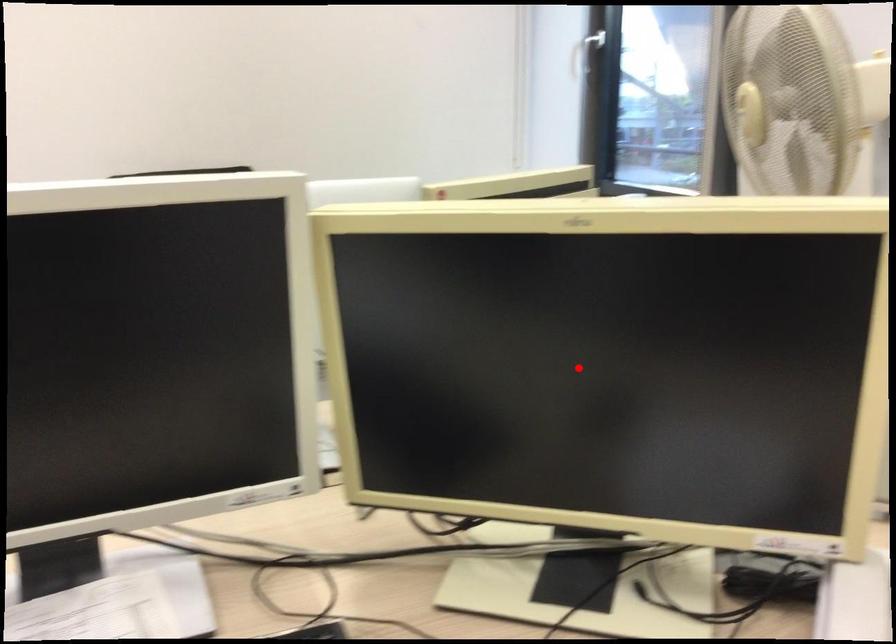
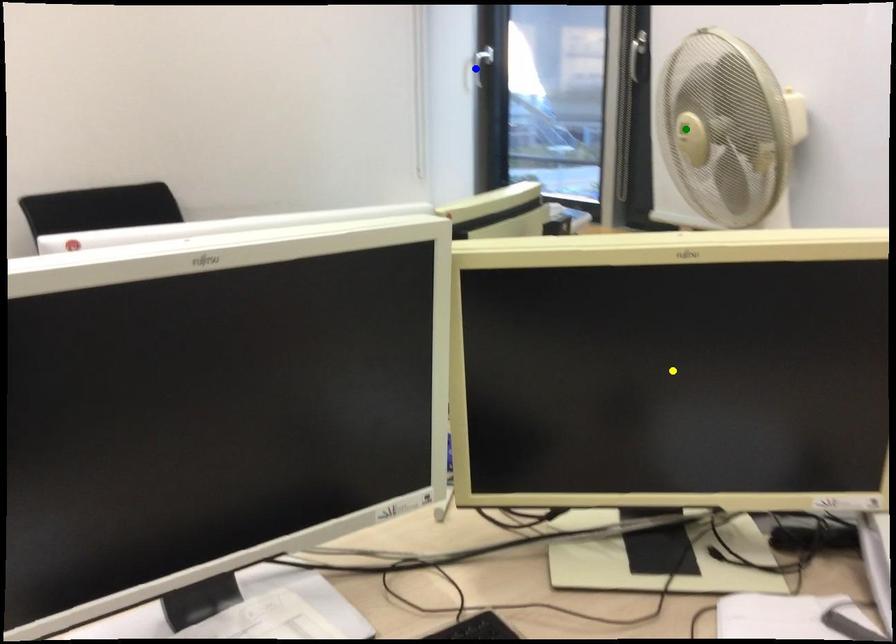
Question: I am providing you with two images of the same scene from different viewpoints. A red point is marked on the first image. You are given multiple points on the second image. Which point in image 2 is actually the same real-world point as the red point in image 1?

Choices:
 (A) yellow point
 (B) green point
 (C) blue point

Answer: (A)